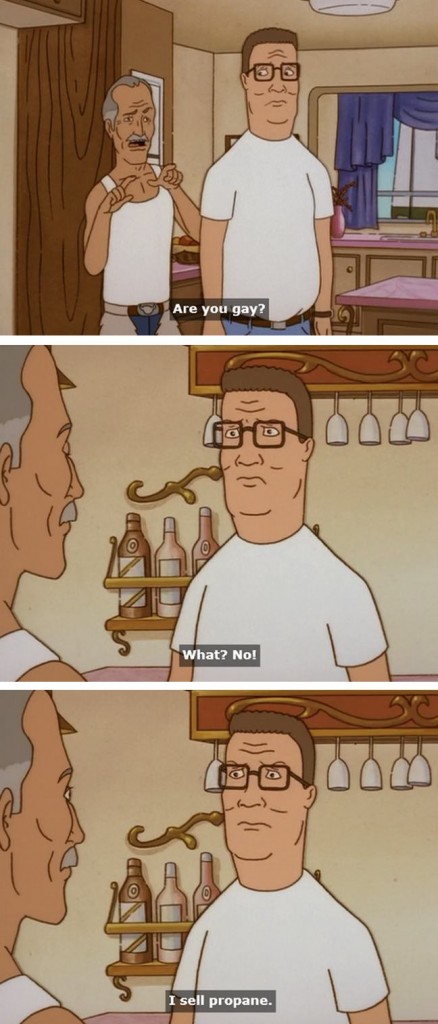
The image size is (438, 1024). In order to click on shelf in this screenshot , I will do `click(138, 968)`, `click(148, 618)`.